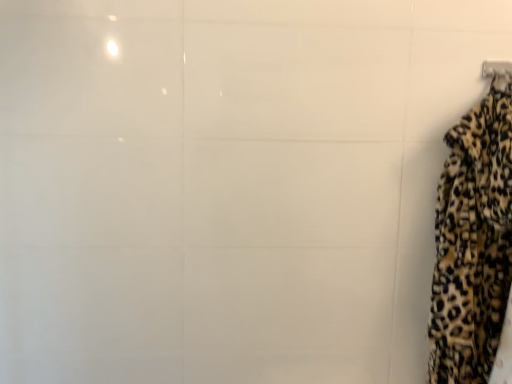
Question: Relative to metallic silver hanger at upper right, is leopard print fabric at right in front or behind?

Choices:
 (A) front
 (B) behind

Answer: (A)

Question: Based on their sizes in the image, would you say leopard print fabric at right is bigger or smaller than metallic silver hanger at upper right?

Choices:
 (A) small
 (B) big

Answer: (B)

Question: Considering the positions of point (501, 125) and point (482, 74), is point (501, 125) closer or farther from the camera than point (482, 74)?

Choices:
 (A) closer
 (B) farther

Answer: (A)

Question: In terms of height, does metallic silver hanger at upper right look taller or shorter compared to leopard print fabric at right?

Choices:
 (A) short
 (B) tall

Answer: (A)

Question: Is metallic silver hanger at upper right inside or outside of leopard print fabric at right?

Choices:
 (A) outside
 (B) inside

Answer: (B)

Question: Is metallic silver hanger at upper right in front of or behind leopard print fabric at right in the image?

Choices:
 (A) front
 (B) behind

Answer: (B)

Question: Considering the positions of point (500, 66) and point (468, 354), is point (500, 66) closer or farther from the camera than point (468, 354)?

Choices:
 (A) closer
 (B) farther

Answer: (B)